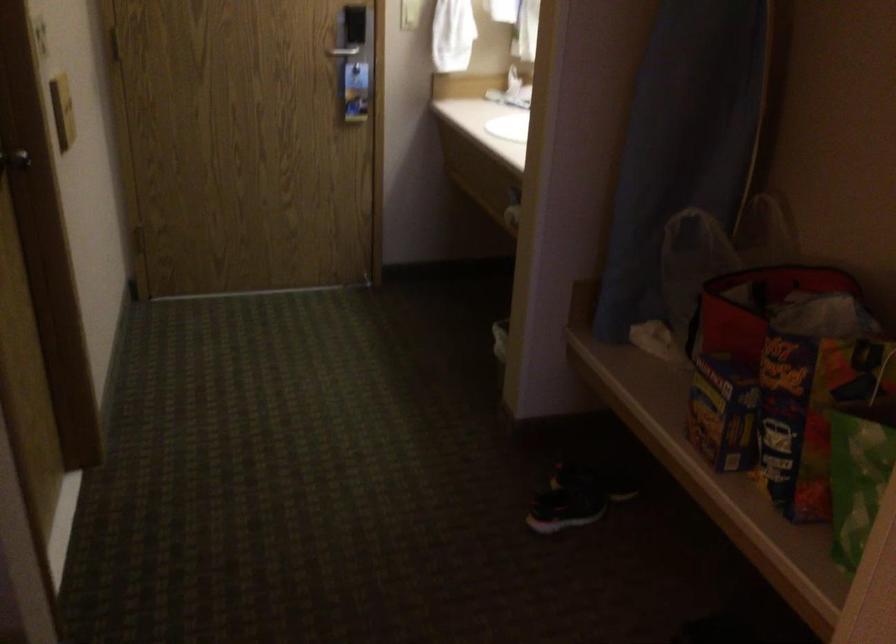
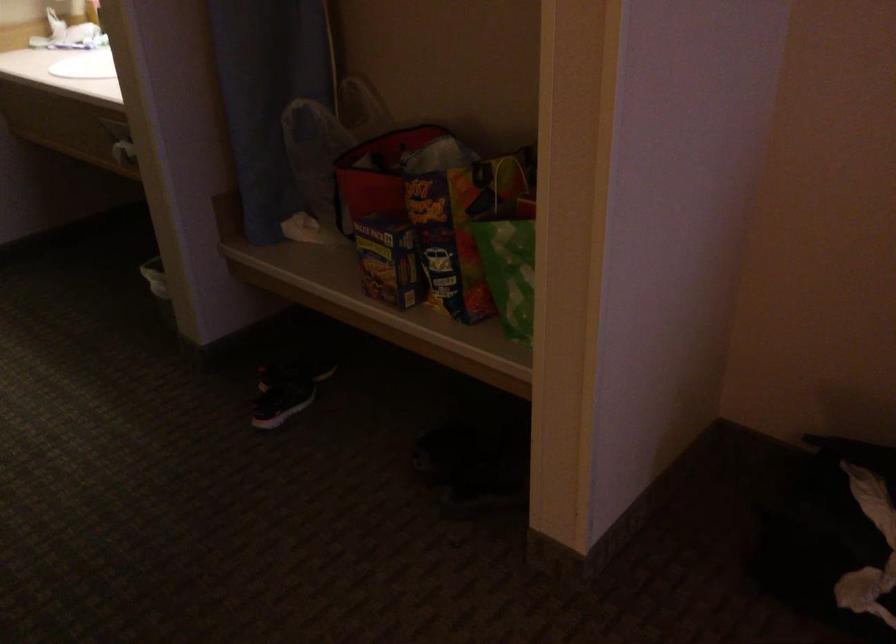
Question: The camera is either moving clockwise (left) or counter-clockwise (right) around the object. The first image is from the beginning of the video and the second image is from the end. Is the camera moving left or right when shooting the video?

Choices:
 (A) Left
 (B) Right

Answer: (A)